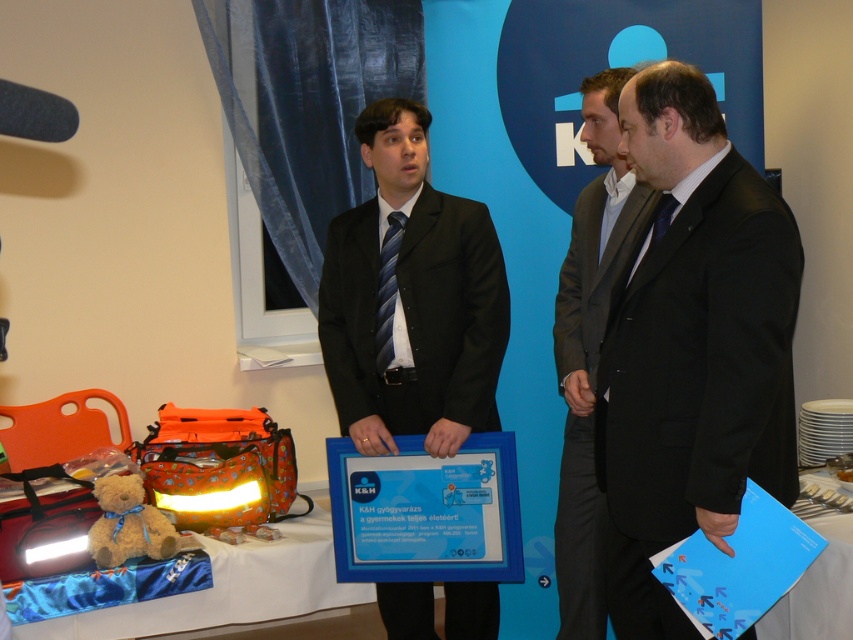
Where is the black matte suit at center located in the image?

The black matte suit at center is located at point (692, 348) in the image.

You are attending a formal event and need to place a soft brown teddy bear at lower left on the white satin table at lower left. Can the teddy bear fit on the table?

The white satin table at lower left is bigger than the soft brown teddy bear at lower left, so yes, the teddy bear can fit on the table.

You are a guest at this formal event and need to place a small gift on the closest available surface. Which object should you choose between the white satin table at lower left and the soft brown teddy bear at lower left?

The white satin table at lower left is in front of the soft brown teddy bear at lower left, meaning it is closer to you. Therefore, you should place the gift on the white satin table at lower left.